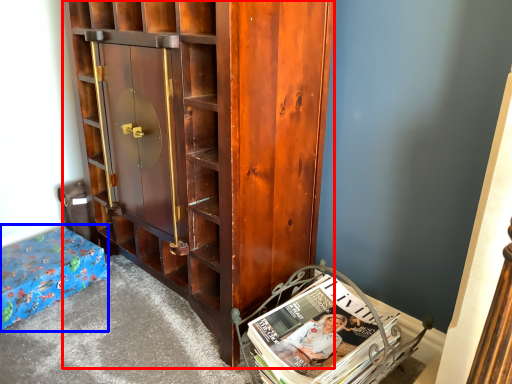
Question: Which object is closer to the camera taking this photo, cabinetry (highlighted by a red box) or furniture (highlighted by a blue box)?

Choices:
 (A) cabinetry
 (B) furniture

Answer: (A)